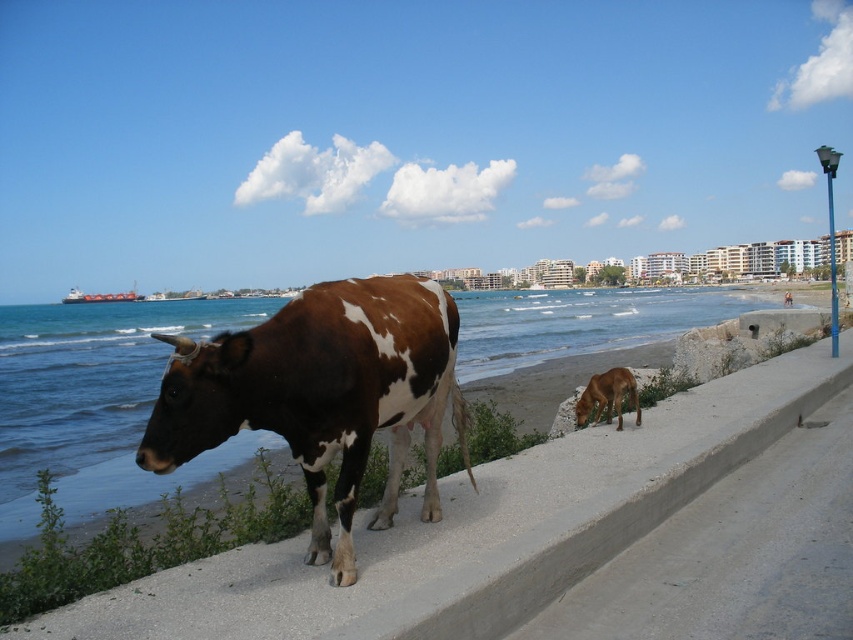
You are a photographer standing at the edge of the beach, wanting to take a photo of both the brown glossy water at center and the brown and white speckled cow at center. Which object is closer to you so that it appears larger in the photo?

The brown and white speckled cow at center is closer to you than the brown glossy water at center, so it will appear larger in the photo.

You are standing at the beach and want to take a photo of both the cow and the dog. The cow is at point (96,346) and the dog is at point (305,340). Which point is closer to you so you can focus your camera properly?

Point (96,346) is closer to you than point (305,340), so you should focus on that point first.